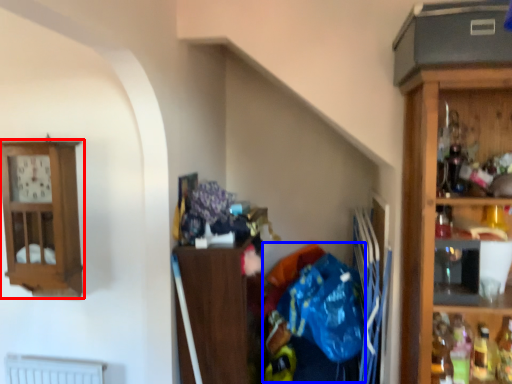
Question: Which of the following is the farthest to the observer, cabinetry (highlighted by a red box) or waste (highlighted by a blue box)?

Choices:
 (A) cabinetry
 (B) waste

Answer: (A)